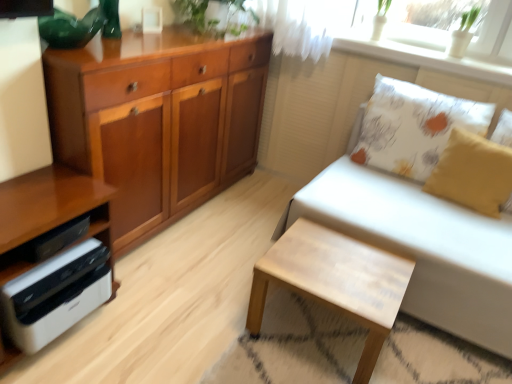
What is the approximate width of white textured cushion at upper right?

11.31 inches.

Find the location of a particular element. yellow fabric pillow at right, which appears as the 2th pillow when viewed from the back is located at coordinates (473, 173).

What do you see at coordinates (412, 127) in the screenshot? I see `white printed cushion at upper right, positioned as the 1th pillow in back-to-front order` at bounding box center [412, 127].

The height and width of the screenshot is (384, 512). Find the location of `white glossy printer at lower left`. white glossy printer at lower left is located at coordinates click(49, 210).

You are a GUI agent. You are given a task and a screenshot of the screen. Output one action in this format:
    pyautogui.click(x=<x>, y=<y>)
    Task: Click on the white textured cushion at upper right
    This screenshot has height=384, width=512.
    Given the screenshot: What is the action you would take?
    pyautogui.click(x=422, y=51)

Considering the relative sizes of white textured cushion at upper right and white leather stool at lower right in the image provided, is white textured cushion at upper right smaller than white leather stool at lower right?

Yes.

Is white textured cushion at upper right surrounding white leather stool at lower right?

No, white leather stool at lower right is not surrounded by white textured cushion at upper right.

How different are the orientations of white textured cushion at upper right and white leather stool at lower right in degrees?

The facing directions of white textured cushion at upper right and white leather stool at lower right are 0.662 degrees apart.

Is white textured cushion at upper right closer to the viewer compared to yellow fabric pillow at right, the first pillow from the front?

No, white textured cushion at upper right is behind yellow fabric pillow at right, the first pillow from the front.

Which point is more distant from viewer, (465, 64) or (469, 142)?

Point (465, 64)

From a real-world perspective, is white textured cushion at upper right under yellow fabric pillow at right, the first pillow from the front?

Incorrect, from a real-world perspective, white textured cushion at upper right is higher than yellow fabric pillow at right, the first pillow from the front.

From the image's perspective, between white textured cushion at upper right and yellow fabric pillow at right, which appears as the 2th pillow when viewed from the back, which one is located above?

white textured cushion at upper right.

How different are the orientations of yellow fabric pillow at right, which appears as the 2th pillow when viewed from the back, and white glossy printer at lower left in degrees?

The facing directions of yellow fabric pillow at right, which appears as the 2th pillow when viewed from the back, and white glossy printer at lower left are 90.9 degrees apart.

Consider the image. From the image's perspective, between yellow fabric pillow at right, the first pillow from the front, and white glossy printer at lower left, which one is located above?

yellow fabric pillow at right, the first pillow from the front, from the image's perspective.

Which of these two, yellow fabric pillow at right, the first pillow from the front, or white glossy printer at lower left, is bigger?

Bigger between the two is white glossy printer at lower left.

Does yellow fabric pillow at right, the first pillow from the front, turn towards white glossy printer at lower left?

No, yellow fabric pillow at right, the first pillow from the front, is not facing towards white glossy printer at lower left.

Considering the sizes of objects white leather stool at lower right and wooden cabinet at left in the image provided, who is wider, white leather stool at lower right or wooden cabinet at left?

white leather stool at lower right is wider.

Is point (316, 233) closer to viewer compared to point (192, 108)?

Yes, point (316, 233) is in front of point (192, 108).

Does white leather stool at lower right touch wooden cabinet at left?

No, white leather stool at lower right is not beside wooden cabinet at left.

From a real-world perspective, is white leather stool at lower right on wooden cabinet at left?

No, from a real-world perspective, white leather stool at lower right is not on top of wooden cabinet at left.

Is green leafy plant at upper center wider than white fabric couch at right?

In fact, green leafy plant at upper center might be narrower than white fabric couch at right.

From a real-world perspective, between green leafy plant at upper center and white fabric couch at right, who is vertically higher?

green leafy plant at upper center, from a real-world perspective.

Does green leafy plant at upper center have a smaller size compared to white fabric couch at right?

Yes.

What's the angular difference between green leafy plant at upper center and white fabric couch at right's facing directions?

93.3 degrees separate the facing orientations of green leafy plant at upper center and white fabric couch at right.

Is white fabric couch at right next to white glossy printer at lower left?

No, white fabric couch at right is not next to white glossy printer at lower left.

From the image's perspective, is white fabric couch at right located above or below white glossy printer at lower left?

Based on their image positions, white fabric couch at right is located above white glossy printer at lower left.

In the scene shown: Can you confirm if white fabric couch at right is bigger than white glossy printer at lower left?

Correct, white fabric couch at right is larger in size than white glossy printer at lower left.

Between white fabric couch at right and white glossy printer at lower left, which one has smaller width?

With smaller width is white glossy printer at lower left.

Which of these two, wooden cabinet at left or white glossy printer at lower left, is wider?

wooden cabinet at left.

Locate an element on the screen. The image size is (512, 384). cabinetry below the wooden cabinet at left (from the image's perspective) is located at coordinates (49, 210).

Is wooden cabinet at left not close to white glossy printer at lower left?

No.

Which of these two, wooden cabinet at left or white glossy printer at lower left, stands shorter?

Standing shorter between the two is white glossy printer at lower left.

The height and width of the screenshot is (384, 512). What are the coordinates of `window sill lying above the white leather stool at lower right (from the image's perspective)` in the screenshot? It's located at (422, 51).

Locate an element on the screen. The height and width of the screenshot is (384, 512). the 2nd pillow below the white textured cushion at upper right (from a real-world perspective) is located at coordinates (473, 173).

Considering their positions, is white textured cushion at upper right positioned closer to green leafy plant at upper center than white leather stool at lower right?

white textured cushion at upper right lies closer to green leafy plant at upper center than the other object.

Based on their spatial positions, is wooden cabinet at left or white leather stool at lower right closer to white glossy printer at lower left?

Among the two, wooden cabinet at left is located nearer to white glossy printer at lower left.

Which object lies nearer to the anchor point white textured cushion at upper right, wooden cabinet at left or green leafy plant at upper center?

green leafy plant at upper center is closer to white textured cushion at upper right.

Based on their spatial positions, is wooden cabinet at left or white printed cushion at upper right, positioned as the 1th pillow in back-to-front order, closer to green leafy plant at upper center?

Among the two, wooden cabinet at left is located nearer to green leafy plant at upper center.

Which object lies nearer to the anchor point yellow fabric pillow at right, the first pillow from the front, white fabric couch at right or white printed cushion at upper right, positioned as the 1th pillow in back-to-front order?

white printed cushion at upper right, positioned as the 1th pillow in back-to-front order, is closer to yellow fabric pillow at right, the first pillow from the front.

Looking at this image, looking at the image, which one is located closer to white textured cushion at upper right, white fabric couch at right or green leafy plant at upper center?

Among the two, white fabric couch at right is located nearer to white textured cushion at upper right.

Based on their spatial positions, is wooden cabinet at left or white glossy printer at lower left further from white textured cushion at upper right?

Among the two, white glossy printer at lower left is located further to white textured cushion at upper right.

When comparing their distances from white fabric couch at right, does white glossy printer at lower left or white printed cushion at upper right, positioned as the 1th pillow in back-to-front order, seem closer?

white printed cushion at upper right, positioned as the 1th pillow in back-to-front order.

Identify the location of pillow that lies between white textured cushion at upper right and yellow fabric pillow at right, the first pillow from the front, from top to bottom. (412, 127).

Where is `studio couch situated between white leather stool at lower right and yellow fabric pillow at right, the first pillow from the front, from left to right`? Image resolution: width=512 pixels, height=384 pixels. studio couch situated between white leather stool at lower right and yellow fabric pillow at right, the first pillow from the front, from left to right is located at coordinates (421, 221).

Where is `chest of drawers between green leafy plant at upper center and white glossy printer at lower left in the up-down direction`? The height and width of the screenshot is (384, 512). chest of drawers between green leafy plant at upper center and white glossy printer at lower left in the up-down direction is located at coordinates (158, 120).

Where is `pillow located between white glossy printer at lower left and white textured cushion at upper right in the left-right direction`? This screenshot has height=384, width=512. pillow located between white glossy printer at lower left and white textured cushion at upper right in the left-right direction is located at coordinates (412, 127).